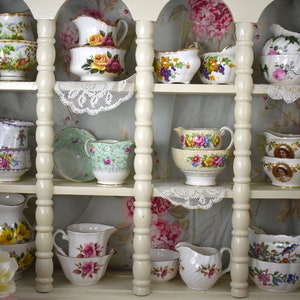
This screenshot has width=300, height=300. I want to click on cups on bottom shelf, so click(x=270, y=268), click(x=269, y=251), click(x=204, y=268), click(x=163, y=268), click(x=90, y=263), click(x=88, y=248), click(x=6, y=226), click(x=29, y=252).